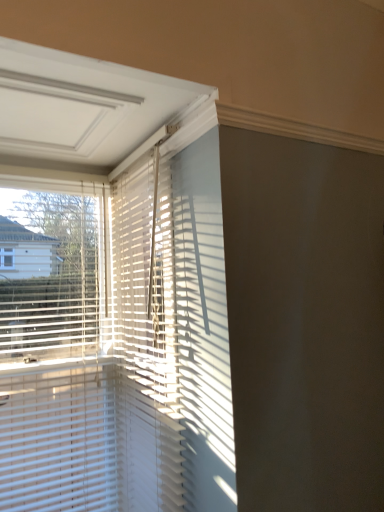
Find the location of a particular element. This screenshot has width=384, height=512. white matte blinds at upper left is located at coordinates (146, 338).

What is the approximate width of white matte blinds at upper left?

The width of white matte blinds at upper left is 9.82 centimeters.

Measure the distance between point (127, 351) and camera.

A distance of 1.89 meters exists between point (127, 351) and camera.

What is the approximate height of white matte blinds at upper left?

1.44 meters.

The image size is (384, 512). Describe the element at coordinates (146, 338) in the screenshot. I see `white matte blinds at upper left` at that location.

Where is `white matte blinds at upper left`? white matte blinds at upper left is located at coordinates (146, 338).